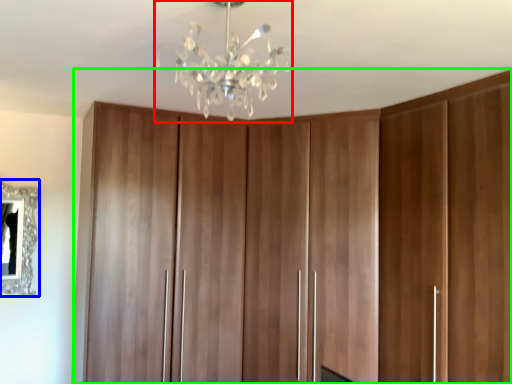
Question: Which object is the farthest from lamp (highlighted by a red box)? Choose among these: mirror (highlighted by a blue box) or cupboard (highlighted by a green box).

Choices:
 (A) mirror
 (B) cupboard

Answer: (A)